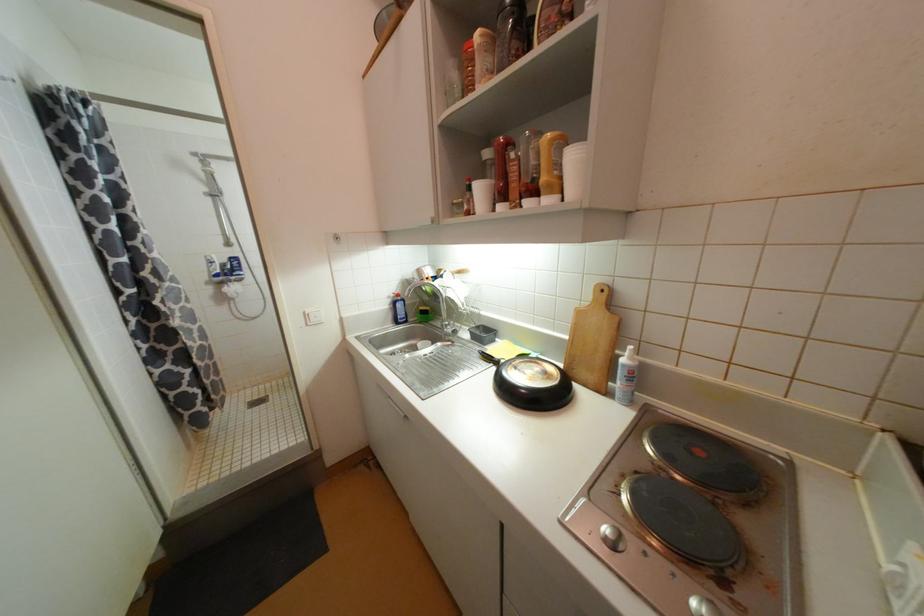
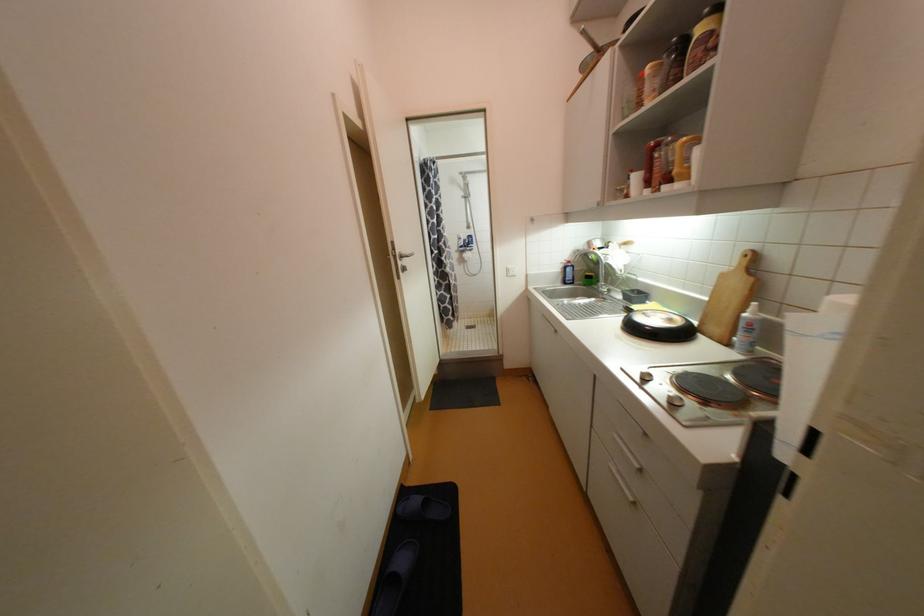
In the second image, find the point that corresponds to point 628,361 in the first image.

(750, 315)